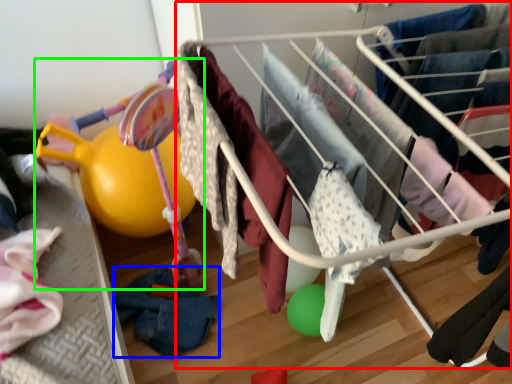
Question: Based on their relative distances, which object is nearer to infant bed (highlighted by a red box)? Choose from clothing (highlighted by a blue box) and baby carriage (highlighted by a green box).

Choices:
 (A) clothing
 (B) baby carriage

Answer: (B)